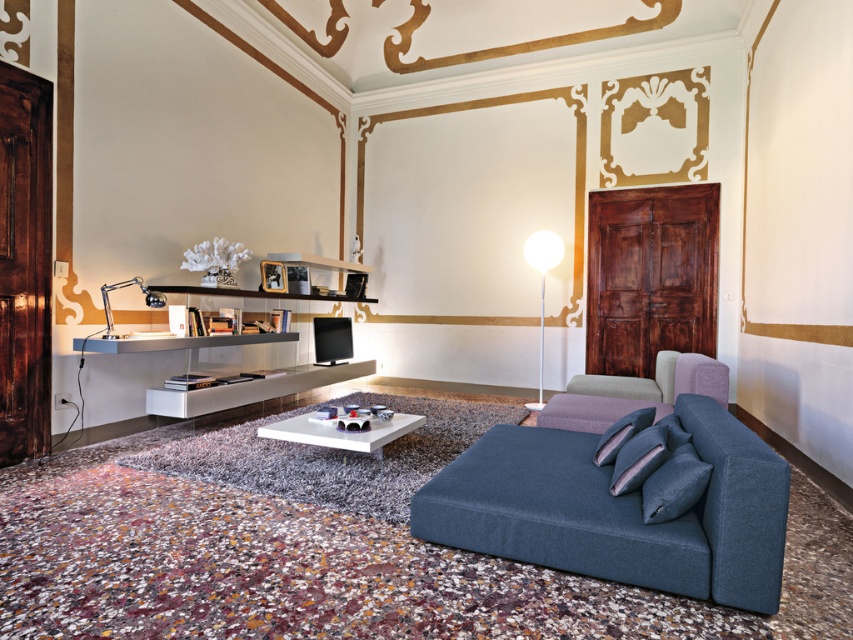
Consider the image. You are standing in the living room and want to place a new plant stand. The plant stand requires a space that is at least 1 meter away from the velvet blue couch at lower right. Based on the coordinates provided, can you determine if the plant stand can be placed at point A located at coordinates 0.8, 0.7?

The velvet blue couch at lower right is at point (x=618, y=509). The distance between point A and the couch is less than 1 meter, so placing the plant stand there would violate the requirement. Choose another location further away.

You are planning to place a large potted plant between the gray fabric armchair at right and the white glossy coffee table at center. Considering their sizes, which object should the plant be closer to?

The gray fabric armchair at right is bigger than the white glossy coffee table at center, so the plant should be placed closer to the gray fabric armchair at right to balance the size difference.

You are standing in the living room and want to place a large potted plant between the velvet blue couch at lower right and the gray fabric armchair at right. Based on their positions, which direction should you place the plant relative to the armchair?

The velvet blue couch at lower right is below the gray fabric armchair at right, so placing the plant below the armchair would position it between the two objects.